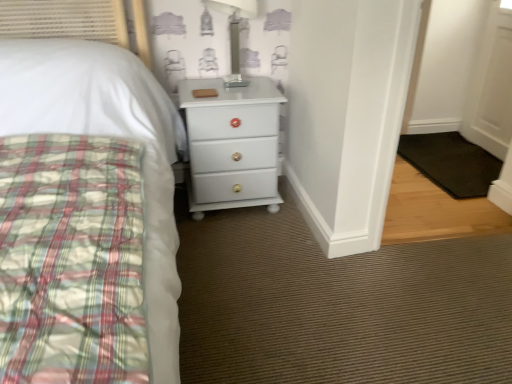
Question: Is transparent glass table lamp at upper center inside the boundaries of white glossy chest of drawers at center, or outside?

Choices:
 (A) outside
 (B) inside

Answer: (A)

Question: From the image's perspective, is transparent glass table lamp at upper center positioned above or below white glossy chest of drawers at center?

Choices:
 (A) above
 (B) below

Answer: (A)

Question: Estimate the real-world distances between objects in this image. Which object is farther from the black rubber mat at lower right?

Choices:
 (A) white glossy chest of drawers at center
 (B) transparent glass table lamp at upper center

Answer: (B)

Question: Which object is positioned closest to the transparent glass table lamp at upper center?

Choices:
 (A) white glossy chest of drawers at center
 (B) black rubber mat at lower right

Answer: (A)